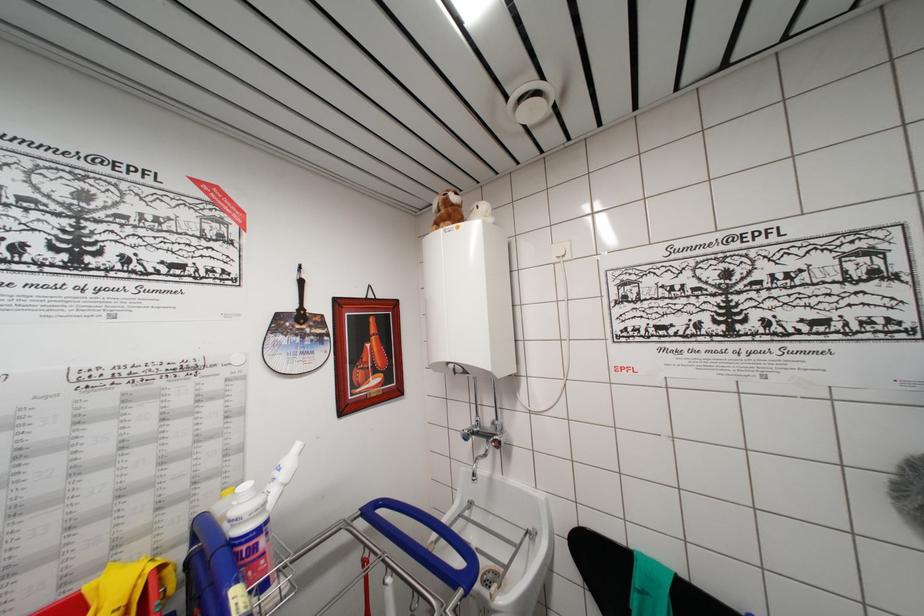
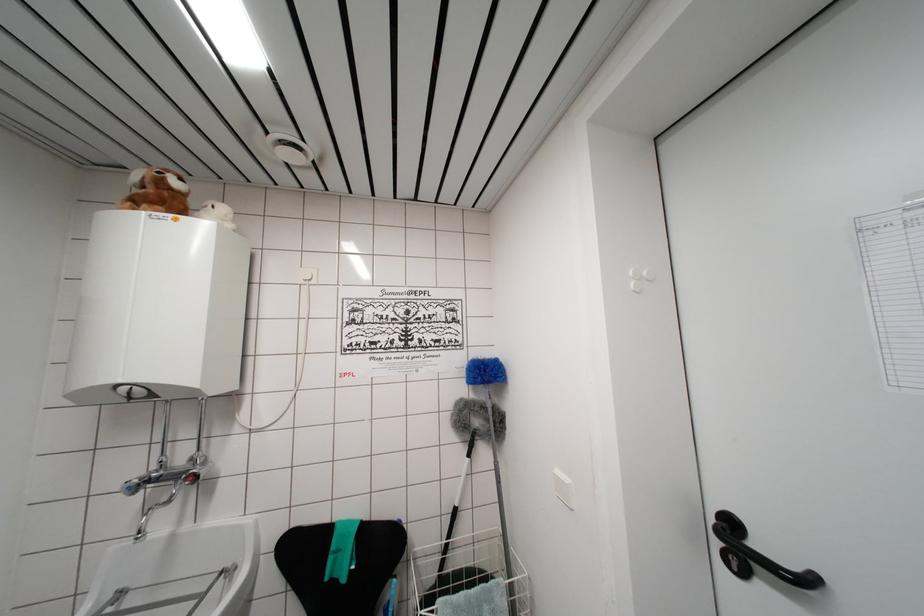
Find the pixel in the second image that matches point 455,224 in the first image.

(168, 209)